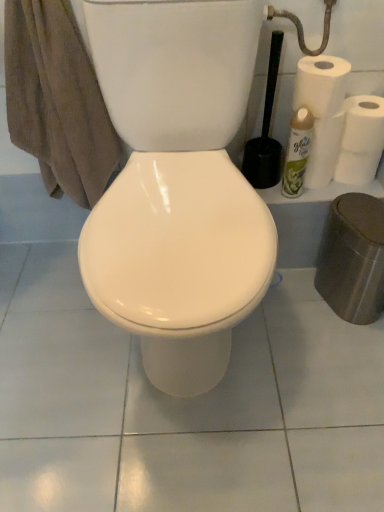
Question: In terms of width, does white matte toilet paper at right look wider or thinner when compared to white matte paper towel at upper right, the first paper towel positioned from the back?

Choices:
 (A) thin
 (B) wide

Answer: (A)

Question: Considering their positions, is white matte toilet paper at right located in front of or behind white matte paper towel at upper right, which appears as the 2th paper towel when viewed from the top?

Choices:
 (A) behind
 (B) front

Answer: (B)

Question: Which of these objects is positioned farthest from the green matte air freshener at right?

Choices:
 (A) white matte paper towel at upper right, the first paper towel positioned from the back
 (B) brown cotton towel at left
 (C) black plastic toilet brush at right
 (D) white matte paper towel at upper right, arranged as the second paper towel when viewed from the right
 (E) white matte toilet paper at right

Answer: (B)

Question: Which of these objects is positioned closest to the white matte toilet paper at right?

Choices:
 (A) green matte air freshener at right
 (B) white matte paper towel at upper right, positioned as the second paper towel in back-to-front order
 (C) white matte paper towel at upper right, arranged as the first paper towel when viewed from the right
 (D) brown cotton towel at left
 (E) black plastic toilet brush at right

Answer: (C)